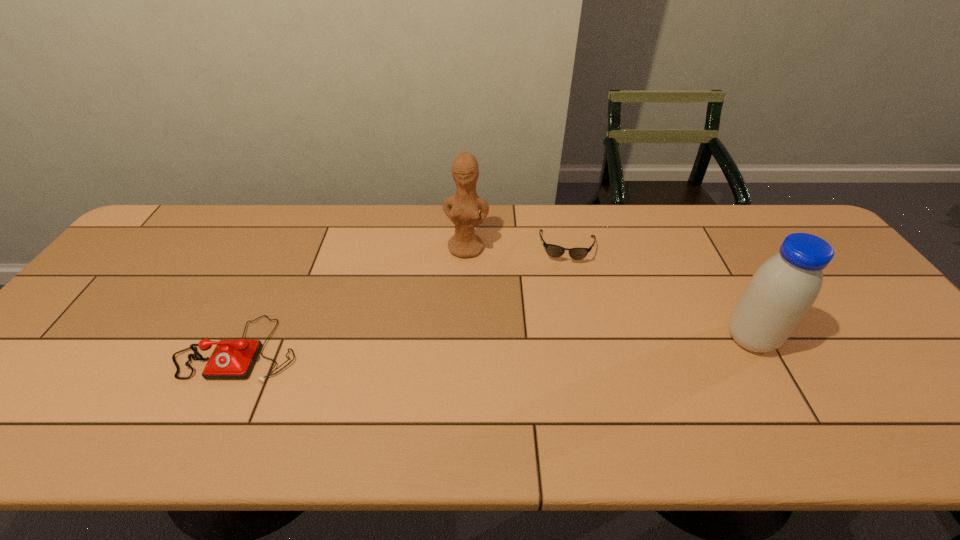
The image size is (960, 540). I want to click on free point at the near right corner, so click(927, 378).

Where is `vacant area between the figurine and the rightmost object`? vacant area between the figurine and the rightmost object is located at coordinates (609, 293).

Identify the location of vacant area between the soya milk and the sunglasses. The image size is (960, 540). (659, 293).

Locate an element on the screen. The height and width of the screenshot is (540, 960). vacant space that is in between the figurine and the third tallest object is located at coordinates (353, 299).

This screenshot has height=540, width=960. Identify the location of free space between the soya milk and the second object from right to left. (659, 293).

Image resolution: width=960 pixels, height=540 pixels. I want to click on vacant point located between the shortest object and the rightmost object, so click(x=659, y=293).

Where is `vacant point located between the sunglasses and the figurine`? Image resolution: width=960 pixels, height=540 pixels. vacant point located between the sunglasses and the figurine is located at coordinates (516, 247).

This screenshot has height=540, width=960. In order to click on free space that is in between the rightmost object and the sunglasses in this screenshot , I will do `click(659, 293)`.

In order to click on free area in between the third tallest object and the third object from left to right in this screenshot , I will do `click(403, 298)`.

Where is `unoccupied position between the rightmost object and the sunglasses`? unoccupied position between the rightmost object and the sunglasses is located at coordinates (659, 293).